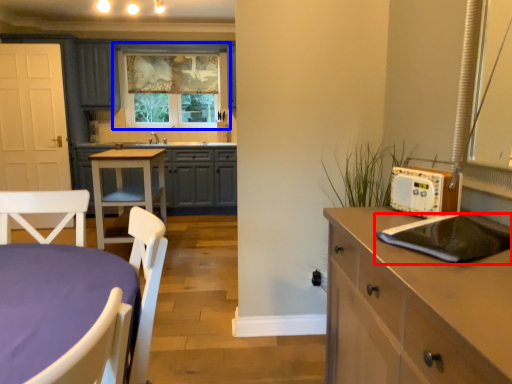
Question: Which of the following is the closest to the observer, kitchen appliance (highlighted by a red box) or window (highlighted by a blue box)?

Choices:
 (A) kitchen appliance
 (B) window

Answer: (A)